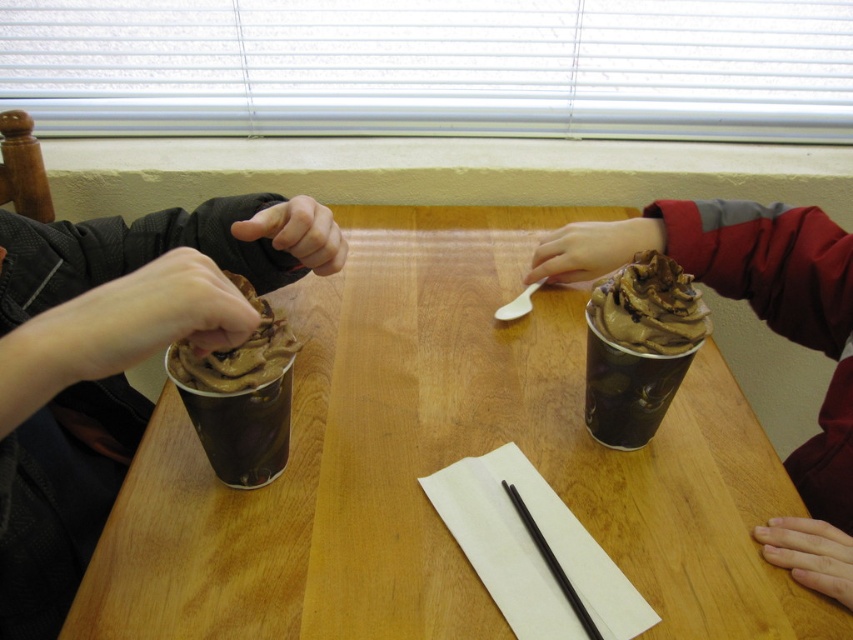
Who is higher up, smooth chocolate ice cream at right or chocolate matte cup at center?

smooth chocolate ice cream at right

Which is in front, point (721, 282) or point (621, 358)?

Point (621, 358) is more forward.

Is point (793, 484) more distant than point (666, 396)?

Yes, point (793, 484) is behind point (666, 396).

The height and width of the screenshot is (640, 853). What are the coordinates of `smooth chocolate ice cream at right` in the screenshot? It's located at (770, 330).

Is point (128, 547) farther from camera compared to point (10, 588)?

Yes, point (128, 547) is behind point (10, 588).

Does wooden table at center appear on the left side of matte chocolate ice cream at left?

In fact, wooden table at center is to the right of matte chocolate ice cream at left.

Is point (566, 481) farther from viewer compared to point (155, 308)?

Yes.

Where is `wooden table at center`? The image size is (853, 640). wooden table at center is located at coordinates (440, 465).

Does matte chocolate ice cream at left have a greater width compared to chocolate frosted cup at left?

Yes, matte chocolate ice cream at left is wider than chocolate frosted cup at left.

Can you confirm if matte chocolate ice cream at left is thinner than chocolate frosted cup at left?

Result: In fact, matte chocolate ice cream at left might be wider than chocolate frosted cup at left.

This screenshot has height=640, width=853. Identify the location of matte chocolate ice cream at left. (113, 362).

Identify the location of matte chocolate ice cream at left. Image resolution: width=853 pixels, height=640 pixels. (113, 362).